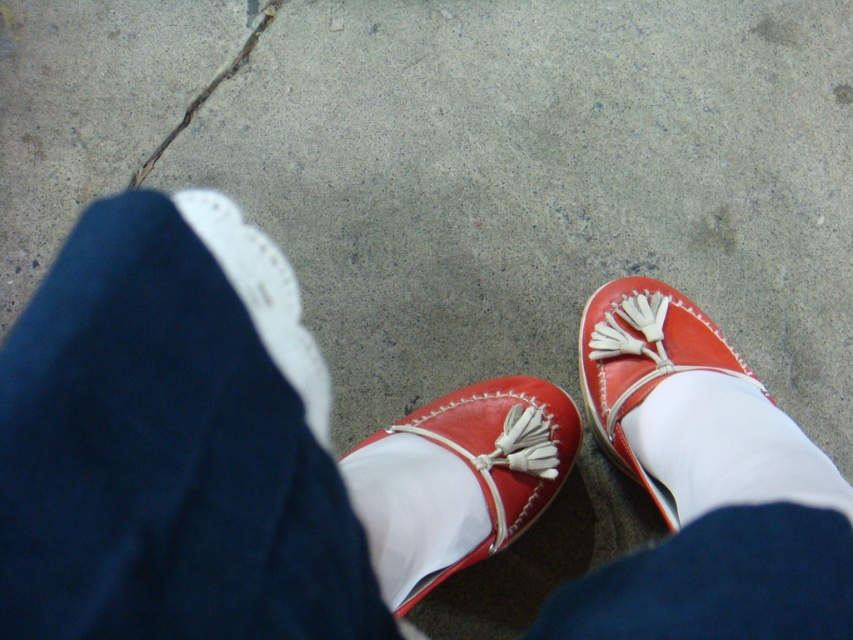
Question: Which object appears farthest from the camera in this image?

Choices:
 (A) white smooth sock at lower right
 (B) white smooth sock at center

Answer: (B)

Question: Observing the image, what is the correct spatial positioning of leather/matte shoe at center in reference to white leather shoe at left?

Choices:
 (A) left
 (B) right

Answer: (B)

Question: Which point is closer to the camera taking this photo?

Choices:
 (A) (703, 467)
 (B) (647, 316)
 (C) (231, 202)

Answer: (A)

Question: Which of the following is the farthest from the observer?

Choices:
 (A) white leather shoe at left
 (B) white smooth sock at center
 (C) white smooth sock at lower right
 (D) matte leather shoes at center

Answer: (A)

Question: Is white smooth sock at lower right smaller than white leather shoe at left?

Choices:
 (A) no
 (B) yes

Answer: (B)

Question: Can you confirm if matte leather shoes at center is positioned to the left of matte leather shoe at lower right?

Choices:
 (A) yes
 (B) no

Answer: (A)